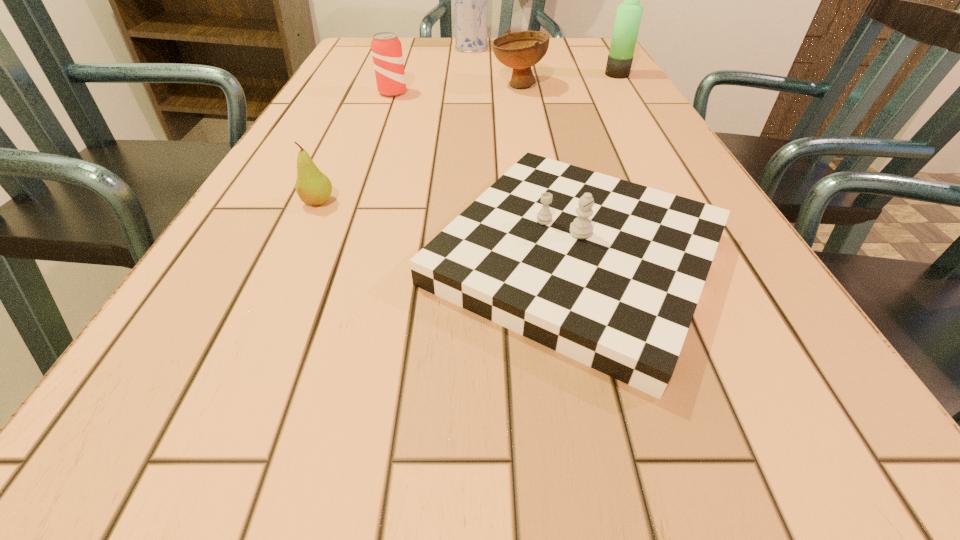
Where is `aerosol can`? aerosol can is located at coordinates [470, 0].

At what (x,y) coordinates should I click in order to perform the action: click on thermos bottle. Please return your answer as a coordinate pair (x, y). Looking at the image, I should click on point(629,13).

The width and height of the screenshot is (960, 540). What are the coordinates of `beer can` in the screenshot? It's located at [386, 48].

Find the location of `soup bowl`. soup bowl is located at coordinates (520, 50).

What are the coordinates of `pear` in the screenshot? It's located at (313, 187).

The image size is (960, 540). In order to click on checkerboard in this screenshot , I will do `click(608, 272)`.

Find the location of `vacant space located on the front of the aerosol can`. vacant space located on the front of the aerosol can is located at coordinates pos(469,97).

Locate an element on the screen. free space located on the left of the thermos bottle is located at coordinates (548, 75).

Locate an element on the screen. This screenshot has width=960, height=540. vacant region located on the right of the beer can is located at coordinates (451, 93).

The image size is (960, 540). I want to click on vacant space located on the back of the soup bowl, so click(512, 44).